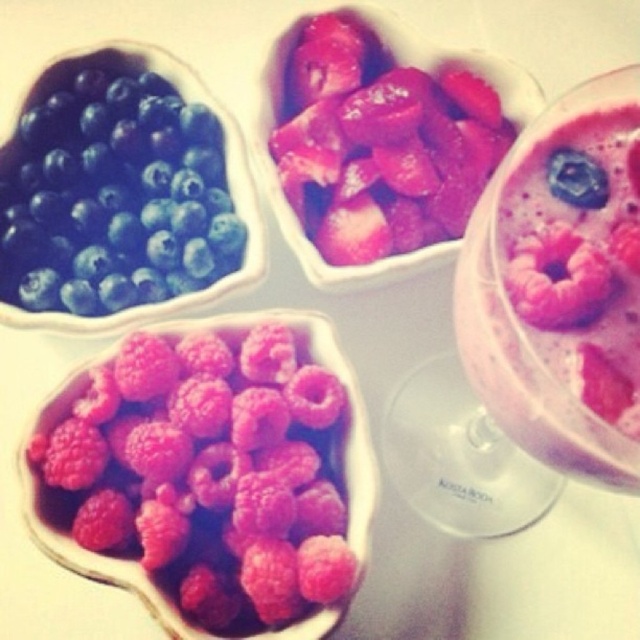
Question: Is matte blueberry at upper left to the left of pink matte raspberry at upper right from the viewer's perspective?

Choices:
 (A) no
 (B) yes

Answer: (B)

Question: In this image, where is matte blueberry at upper left located relative to pink matte raspberry at upper right?

Choices:
 (A) above
 (B) below

Answer: (A)

Question: Which object appears farthest from the camera in this image?

Choices:
 (A) pink matte raspberry at upper right
 (B) bright pink raspberry at center

Answer: (B)

Question: Estimate the real-world distances between objects in this image. Which object is farther from the bright pink raspberry at center?

Choices:
 (A) pink matte raspberry at upper right
 (B) matte blueberry at upper left

Answer: (A)

Question: Which is nearer to the pink matte raspberry at upper right?

Choices:
 (A) bright pink raspberry at center
 (B) matte blueberry at upper left

Answer: (A)

Question: Does matte blueberry at upper left have a greater width compared to pink matte raspberry at upper right?

Choices:
 (A) yes
 (B) no

Answer: (A)